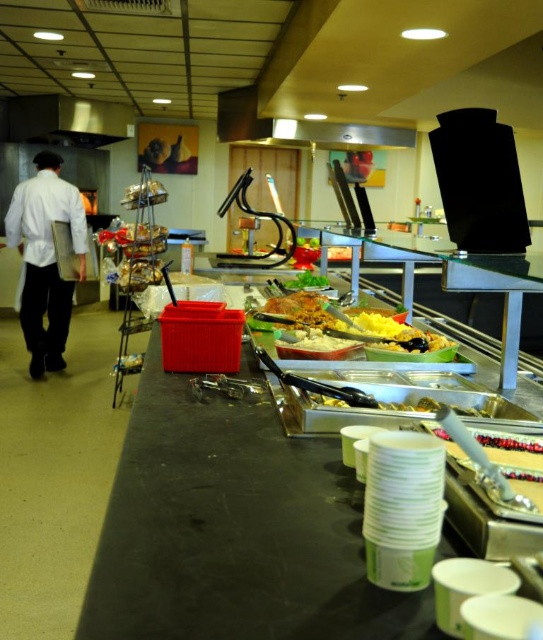
Can you confirm if translucent plastic cups at lower right is smaller than shiny orange pasta at center?

Correct, translucent plastic cups at lower right occupies less space than shiny orange pasta at center.

Can you confirm if translucent plastic cups at lower right is shorter than shiny orange pasta at center?

Indeed, translucent plastic cups at lower right has a lesser height compared to shiny orange pasta at center.

Identify the location of translucent plastic cups at lower right. The height and width of the screenshot is (640, 543). (500, 476).

In order to click on translucent plastic cups at lower right in this screenshot , I will do `click(500, 476)`.

Who is higher up, translucent plastic cups at lower right or white creamy mashed potatoes at center?

white creamy mashed potatoes at center is higher up.

Can you confirm if translucent plastic cups at lower right is smaller than white creamy mashed potatoes at center?

Incorrect, translucent plastic cups at lower right is not smaller in size than white creamy mashed potatoes at center.

Is point (449, 442) positioned behind point (288, 333)?

No, it is in front of (288, 333).

Where is `translucent plastic cups at lower right`? This screenshot has height=640, width=543. translucent plastic cups at lower right is located at coordinates (500, 476).

Which is more to the right, white matte uniform at left or yellow matte food at center?

yellow matte food at center is more to the right.

Where is `white matte uniform at left`? Image resolution: width=543 pixels, height=640 pixels. white matte uniform at left is located at coordinates (46, 259).

Does point (68, 211) come in front of point (392, 346)?

No, (68, 211) is behind (392, 346).

Locate an element on the screen. This screenshot has width=543, height=640. white matte uniform at left is located at coordinates (46, 259).